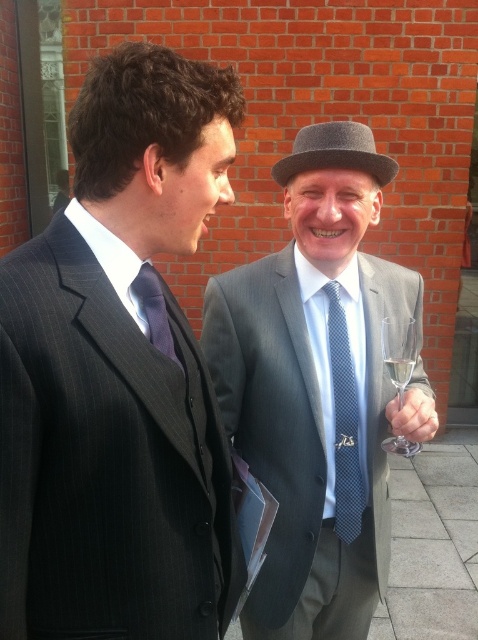
Can you confirm if blue dotted tie at center is bigger than clear glass wine glass at right?

No.

Identify the location of blue dotted tie at center. Image resolution: width=478 pixels, height=640 pixels. (344, 422).

Locate an element on the screen. The height and width of the screenshot is (640, 478). blue dotted tie at center is located at coordinates (344, 422).

Is point (355, 445) in front of point (345, 168)?

No, it is not.

Does blue dotted tie at center appear on the right side of gray felt fedora at upper center?

Correct, you'll find blue dotted tie at center to the right of gray felt fedora at upper center.

Find the location of a particular element. This screenshot has width=478, height=640. blue dotted tie at center is located at coordinates (344, 422).

Can you confirm if pinstriped suit at left is wider than purple satin tie at center?

Indeed, pinstriped suit at left has a greater width compared to purple satin tie at center.

Does pinstriped suit at left have a larger size compared to purple satin tie at center?

Indeed, pinstriped suit at left has a larger size compared to purple satin tie at center.

This screenshot has width=478, height=640. I want to click on pinstriped suit at left, so click(118, 374).

Locate an element on the screen. The width and height of the screenshot is (478, 640). pinstriped suit at left is located at coordinates (118, 374).